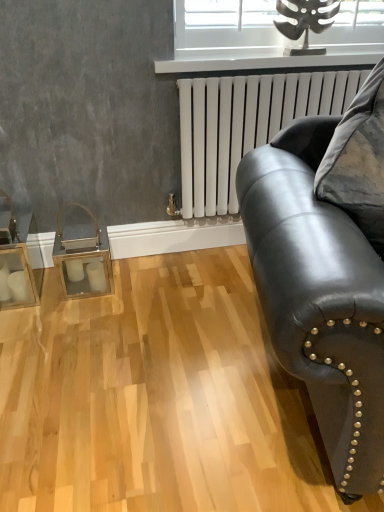
Measure the distance between point (x=379, y=338) and camera.

Point (x=379, y=338) and camera are 30.31 inches apart from each other.

Locate an element on the screen. This screenshot has height=512, width=384. white matte radiator at upper right is located at coordinates (244, 126).

How far apart are metallic silver window at upper center and black leather couch at right?

A distance of 3.45 feet exists between metallic silver window at upper center and black leather couch at right.

Is the surface of metallic silver window at upper center in direct contact with black leather couch at right?

metallic silver window at upper center and black leather couch at right are not in contact.

There is a black leather couch at right. Find the location of `window above it (from a real-world perspective)`. window above it (from a real-world perspective) is located at coordinates (227, 28).

Considering the sizes of objects metallic silver window at upper center and black leather couch at right in the image provided, who is thinner, metallic silver window at upper center or black leather couch at right?

With smaller width is metallic silver window at upper center.

Where is `window sill on the left of the black leather couch at right`? window sill on the left of the black leather couch at right is located at coordinates (265, 63).

In the image, is white glossy radiator at upper center on the left side or the right side of black leather couch at right?

white glossy radiator at upper center is to the left of black leather couch at right.

From a real-world perspective, is white glossy radiator at upper center located higher than black leather couch at right?

Yes, from a real-world perspective, white glossy radiator at upper center is above black leather couch at right.

From their relative heights in the image, would you say white glossy radiator at upper center is taller or shorter than black leather couch at right?

Considering their sizes, white glossy radiator at upper center has less height than black leather couch at right.

Relative to metallic silver window at upper center, is black leather couch at right in front or behind?

black leather couch at right is positioned closer to the viewer than metallic silver window at upper center.

Is black leather couch at right not inside metallic silver window at upper center?

black leather couch at right is positioned outside metallic silver window at upper center.

This screenshot has height=512, width=384. Identify the location of window on the left of the black leather couch at right. (227, 28).

Between point (276, 190) and point (244, 42), which one is positioned in front?

The point (276, 190) is more forward.

From the picture: Between white glossy radiator at upper center and metallic silver window at upper center, which one has more height?

Standing taller between the two is metallic silver window at upper center.

Is white glossy radiator at upper center oriented towards metallic silver window at upper center?

No, white glossy radiator at upper center does not turn towards metallic silver window at upper center.

Which is more to the left, white glossy radiator at upper center or metallic silver window at upper center?

Positioned to the left is white glossy radiator at upper center.

Is white glossy radiator at upper center situated inside metallic silver window at upper center or outside?

white glossy radiator at upper center lies outside metallic silver window at upper center.

Does black leather couch at right have a greater height compared to white glossy radiator at upper center?

Correct, black leather couch at right is much taller as white glossy radiator at upper center.

Between black leather couch at right and white glossy radiator at upper center, which one has larger width?

black leather couch at right is wider.

Which of these two, black leather couch at right or white glossy radiator at upper center, is smaller?

Smaller between the two is white glossy radiator at upper center.

From the image's perspective, who appears lower, black leather couch at right or white glossy radiator at upper center?

black leather couch at right, from the image's perspective.

In terms of width, does black leather couch at right look wider or thinner when compared to white matte radiator at upper right?

Considering their sizes, black leather couch at right looks broader than white matte radiator at upper right.

Does black leather couch at right have a lesser height compared to white matte radiator at upper right?

No, black leather couch at right is not shorter than white matte radiator at upper right.

Considering the relative positions of black leather couch at right and white matte radiator at upper right in the image provided, is black leather couch at right to the left of white matte radiator at upper right from the viewer's perspective?

In fact, black leather couch at right is to the right of white matte radiator at upper right.

Are white glossy radiator at upper center and white matte radiator at upper right located far from each other?

white glossy radiator at upper center is actually quite close to white matte radiator at upper right.

From the image's perspective, is white glossy radiator at upper center on top of white matte radiator at upper right?

Yes, from the image's perspective, white glossy radiator at upper center is on top of white matte radiator at upper right.

Considering the sizes of objects white glossy radiator at upper center and white matte radiator at upper right in the image provided, who is wider, white glossy radiator at upper center or white matte radiator at upper right?

white glossy radiator at upper center is wider.

Considering the positions of objects white glossy radiator at upper center and white matte radiator at upper right in the image provided, who is in front, white glossy radiator at upper center or white matte radiator at upper right?

white glossy radiator at upper center is closer to the camera.

Where is `studio couch that is on the right side of metallic silver window at upper center`? The width and height of the screenshot is (384, 512). studio couch that is on the right side of metallic silver window at upper center is located at coordinates (319, 298).

In order to click on studio couch below the white glossy radiator at upper center (from a real-world perspective) in this screenshot , I will do `click(319, 298)`.

From the image, which object appears to be nearer to metallic silver window at upper center, white glossy radiator at upper center or white matte radiator at upper right?

Among the two, white glossy radiator at upper center is located nearer to metallic silver window at upper center.

When comparing their distances from white glossy radiator at upper center, does metallic silver window at upper center or black leather couch at right seem closer?

metallic silver window at upper center is positioned closer to the anchor white glossy radiator at upper center.

From the image, which object appears to be nearer to metallic silver window at upper center, white matte radiator at upper right or white glossy radiator at upper center?

white glossy radiator at upper center.

When comparing their distances from white glossy radiator at upper center, does white matte radiator at upper right or black leather couch at right seem closer?

white matte radiator at upper right is closer to white glossy radiator at upper center.

Based on the photo, when comparing their distances from black leather couch at right, does metallic silver window at upper center or white glossy radiator at upper center seem further?

Among the two, metallic silver window at upper center is located further to black leather couch at right.

From the image, which object appears to be nearer to black leather couch at right, white matte radiator at upper right or white glossy radiator at upper center?

Based on the image, white matte radiator at upper right appears to be nearer to black leather couch at right.

Consider the image. Considering their positions, is black leather couch at right positioned further to metallic silver window at upper center than white glossy radiator at upper center?

black leather couch at right is further to metallic silver window at upper center.

Looking at the image, which one is located further to metallic silver window at upper center, white glossy radiator at upper center or black leather couch at right?

black leather couch at right lies further to metallic silver window at upper center than the other object.

The width and height of the screenshot is (384, 512). I want to click on window sill positioned between black leather couch at right and white matte radiator at upper right from near to far, so click(x=265, y=63).

Identify the location of window sill between metallic silver window at upper center and white matte radiator at upper right vertically. The width and height of the screenshot is (384, 512). (265, 63).

You are a GUI agent. You are given a task and a screenshot of the screen. Output one action in this format:
    pyautogui.click(x=<x>, y=<y>)
    Task: Click on the radiator between black leather couch at right and metallic silver window at upper center along the z-axis
    The height and width of the screenshot is (512, 384).
    Given the screenshot: What is the action you would take?
    pyautogui.click(x=244, y=126)

Identify the location of window sill located between black leather couch at right and metallic silver window at upper center in the depth direction. The height and width of the screenshot is (512, 384). (265, 63).